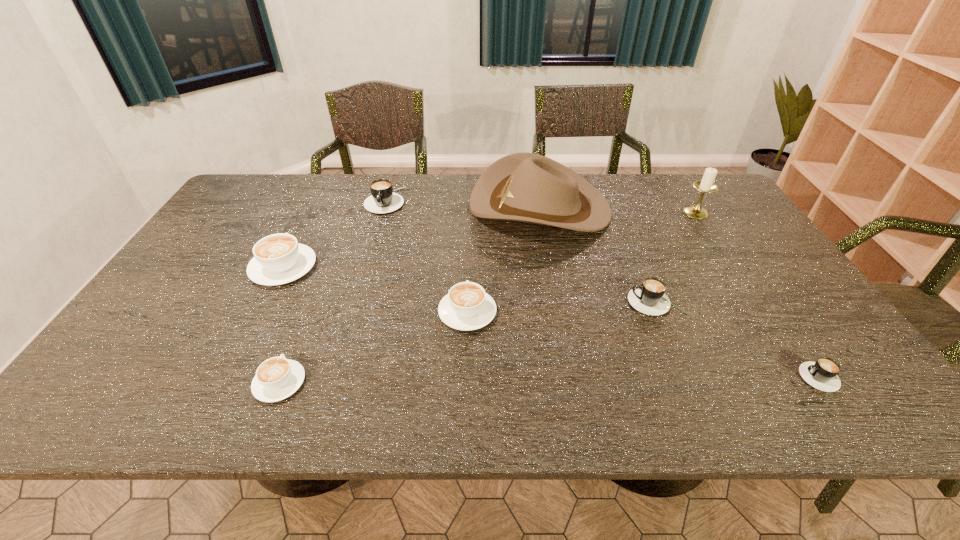
Find the location of a particular element. The image size is (960, 540). vacant space positioned on the side of the rightmost white cappuccino with the handle is located at coordinates (469, 247).

Image resolution: width=960 pixels, height=540 pixels. I want to click on free space located on the side of the rightmost white cappuccino with the handle, so click(x=468, y=262).

This screenshot has width=960, height=540. I want to click on free space located on the side of the rightmost white cappuccino with the handle, so click(469, 256).

Locate an element on the screen. free spot located 0.350m with the handle on the side of the second black cappuccino from right to left is located at coordinates (491, 302).

Image resolution: width=960 pixels, height=540 pixels. In order to click on blank space located 0.200m with the handle on the side of the second black cappuccino from right to left in this screenshot , I will do `click(549, 302)`.

Where is `vacant area situated 0.340m with the handle on the side of the second black cappuccino from right to left`? vacant area situated 0.340m with the handle on the side of the second black cappuccino from right to left is located at coordinates point(494,302).

Find the location of a particular element. free space located on the side of the smallest white cappuccino with the handle is located at coordinates (324, 271).

Locate an element on the screen. This screenshot has width=960, height=540. vacant area located on the side of the smallest white cappuccino with the handle is located at coordinates (327, 261).

Identify the location of blank area located on the side of the smallest white cappuccino with the handle. (326, 264).

Identify the location of vacant region located 0.280m with the handle on the side of the rightmost black cappuccino. The height and width of the screenshot is (540, 960). (671, 377).